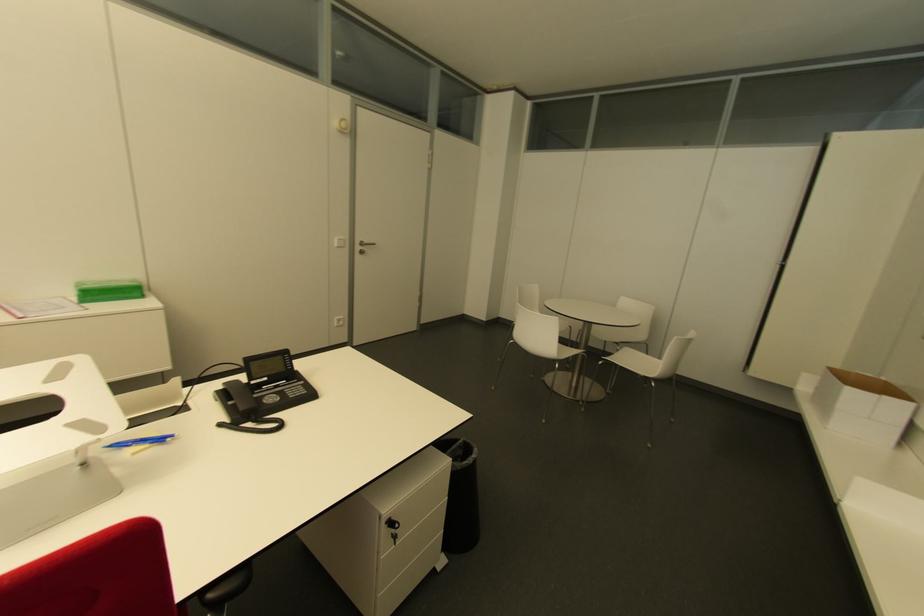
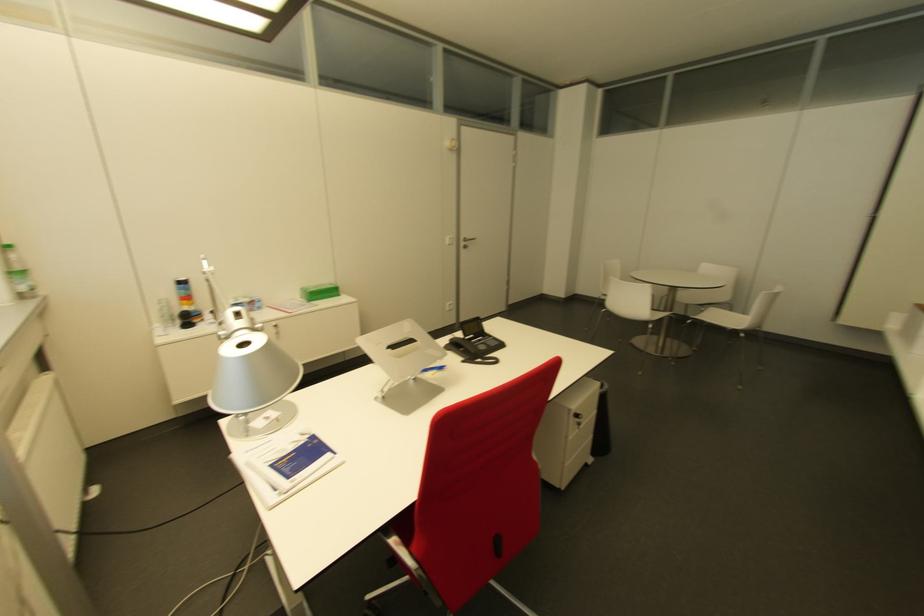
Find the pixel in the second image that matches point 223,384 in the first image.

(447, 339)